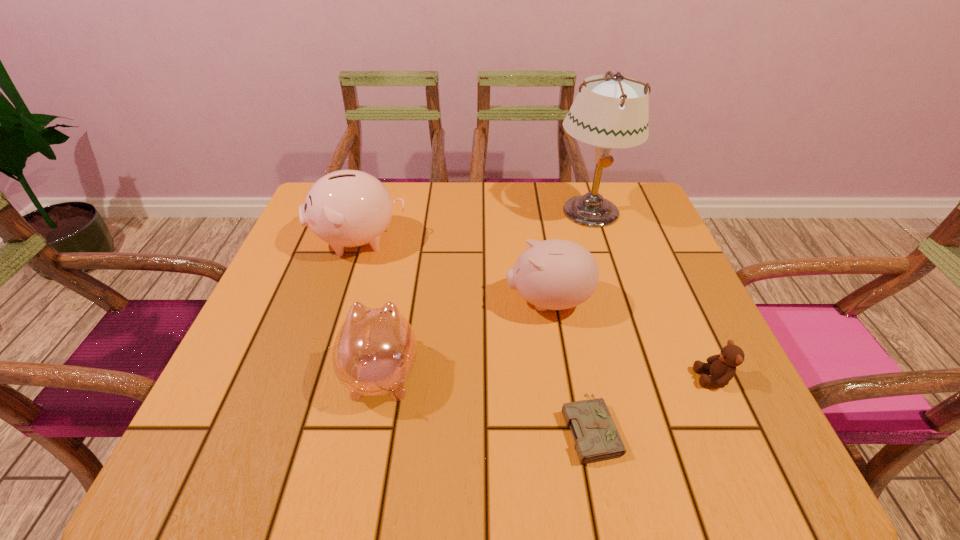
The image size is (960, 540). I want to click on vacant space at the left edge of the desktop, so click(x=279, y=366).

Locate an element on the screen. vacant region at the right edge of the desktop is located at coordinates (645, 359).

Where is `vacant space at the near left corner`? This screenshot has height=540, width=960. vacant space at the near left corner is located at coordinates (220, 450).

In the image, there is a desktop. At what (x,y) coordinates should I click in order to perform the action: click on free space at the far right corner. Please return your answer as a coordinate pair (x, y). Image resolution: width=960 pixels, height=540 pixels. Looking at the image, I should click on (627, 189).

You are a GUI agent. You are given a task and a screenshot of the screen. Output one action in this format:
    pyautogui.click(x=<x>, y=<y>)
    Task: Click on the vacant space at the near right corner
    This screenshot has height=540, width=960.
    Given the screenshot: What is the action you would take?
    pyautogui.click(x=745, y=448)

Identify the location of vacant point located between the tallest piggy bank and the nearest piggy bank. Image resolution: width=960 pixels, height=540 pixels. (371, 307).

Locate an element on the screen. empty space between the nearest piggy bank and the second shortest object is located at coordinates (547, 375).

Find the location of `blank region between the tallest object and the shortest object`. blank region between the tallest object and the shortest object is located at coordinates (589, 319).

Locate an element on the screen. The height and width of the screenshot is (540, 960). vacant point located between the third farthest object and the teddy bear is located at coordinates (631, 340).

This screenshot has height=540, width=960. I want to click on free space that is in between the tallest object and the farthest piggy bank, so click(474, 226).